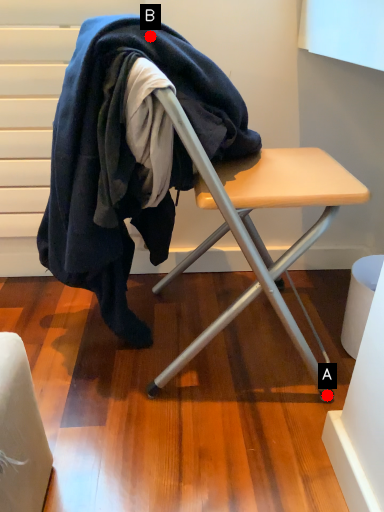
Question: Two points are circled on the image, labeled by A and B beside each circle. Which point is closer to the camera taking this photo?

Choices:
 (A) A is closer
 (B) B is closer

Answer: (B)